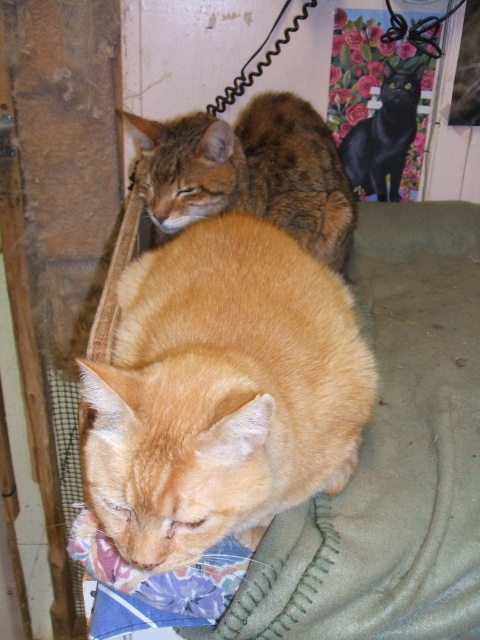
Question: Which is farther from the tabby fur cat at upper left?

Choices:
 (A) orange fur cat at center
 (B) black glossy cat at upper center

Answer: (A)

Question: Can you confirm if orange fur cat at center is positioned to the right of tabby fur cat at upper left?

Choices:
 (A) no
 (B) yes

Answer: (B)

Question: Which of the following is the closest to the observer?

Choices:
 (A) (283, 186)
 (B) (154, 262)

Answer: (B)

Question: Does orange fur cat at center have a lesser width compared to tabby fur cat at upper left?

Choices:
 (A) yes
 (B) no

Answer: (A)

Question: Considering the relative positions of tabby fur cat at upper left and black glossy cat at upper center in the image provided, where is tabby fur cat at upper left located with respect to black glossy cat at upper center?

Choices:
 (A) left
 (B) right

Answer: (A)

Question: Which object is closer to the camera taking this photo?

Choices:
 (A) black glossy cat at upper center
 (B) orange fur cat at center

Answer: (B)